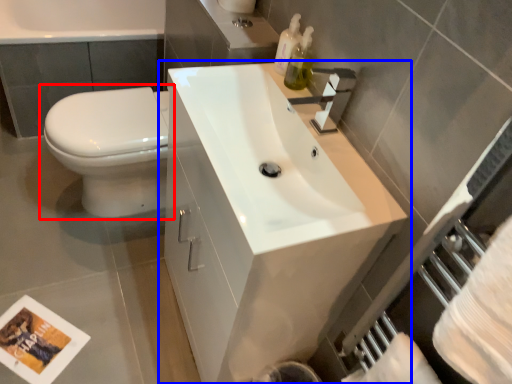
Question: Which of the following is the farthest to the observer, toilet (highlighted by a red box) or bathroom cabinet (highlighted by a blue box)?

Choices:
 (A) toilet
 (B) bathroom cabinet

Answer: (A)